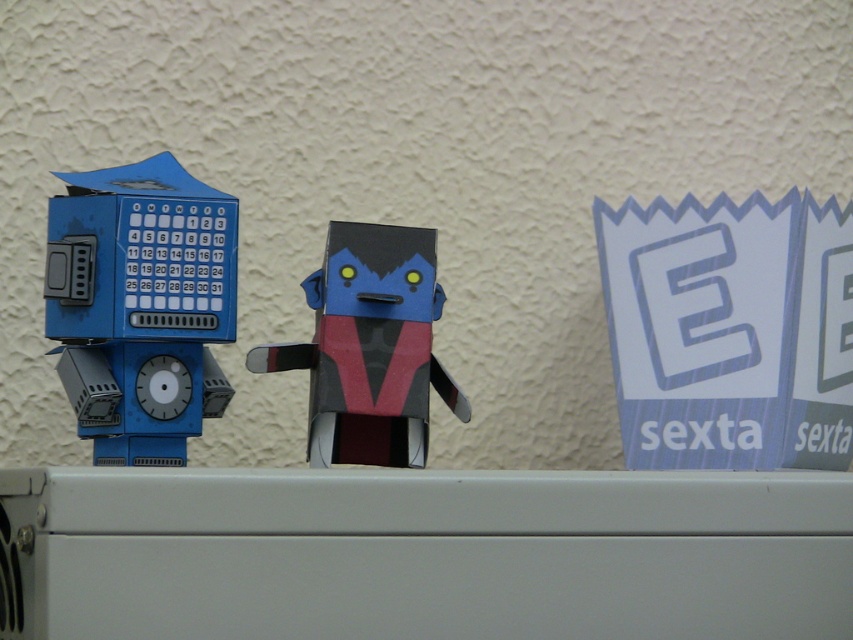
Question: Among these objects, which one is nearest to the camera?

Choices:
 (A) matte black and red cardboard toy at center
 (B) matte blue robot at left

Answer: (B)

Question: Is matte blue robot at left to the left of matte black and red cardboard toy at center from the viewer's perspective?

Choices:
 (A) yes
 (B) no

Answer: (A)

Question: Does matte blue robot at left appear over matte black and red cardboard toy at center?

Choices:
 (A) no
 (B) yes

Answer: (B)

Question: Can you confirm if matte blue robot at left is wider than matte black and red cardboard toy at center?

Choices:
 (A) yes
 (B) no

Answer: (B)

Question: Which of the following is the farthest from the observer?

Choices:
 (A) (115, 422)
 (B) (349, 384)

Answer: (A)